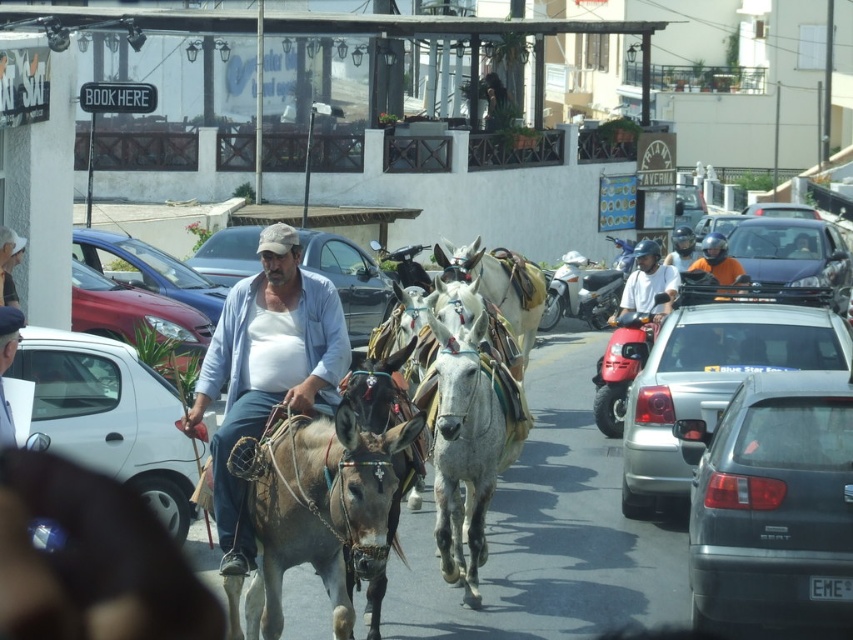
Measure the distance from white glossy donkey at center to metallic blue sedan at center.

white glossy donkey at center is 9.63 meters away from metallic blue sedan at center.

Between white glossy donkey at center and metallic blue sedan at center, which one appears on the right side from the viewer's perspective?

From the viewer's perspective, white glossy donkey at center appears more on the right side.

Is point (520, 406) farther from viewer compared to point (223, 236)?

No, (520, 406) is closer to viewer.

The height and width of the screenshot is (640, 853). What are the coordinates of `white glossy donkey at center` in the screenshot? It's located at (467, 428).

Can you confirm if silver metallic sedan at center is shorter than shiny red sedan at center?

No.

Is silver metallic sedan at center thinner than shiny red sedan at center?

Yes, silver metallic sedan at center is thinner than shiny red sedan at center.

Between point (751, 356) and point (178, 268), which one is positioned in front?

Point (751, 356) is in front.

Where is `silver metallic sedan at center`? The image size is (853, 640). silver metallic sedan at center is located at coordinates (711, 380).

Does silver metallic sedan at center have a lesser height compared to metallic silver sedan at left?

In fact, silver metallic sedan at center may be taller than metallic silver sedan at left.

Does silver metallic sedan at center come in front of metallic silver sedan at left?

That is True.

Is point (630, 500) positioned before point (122, 337)?

Yes.

At what (x,y) coordinates should I click in order to perform the action: click on silver metallic sedan at center. Please return your answer as a coordinate pair (x, y). Looking at the image, I should click on (711, 380).